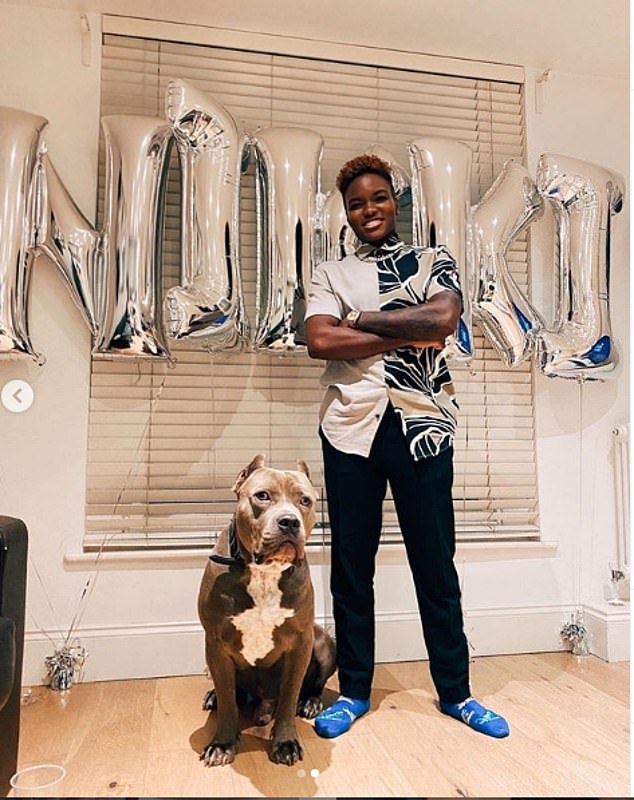
Identify the location of floor. This screenshot has width=634, height=800. (558, 746).